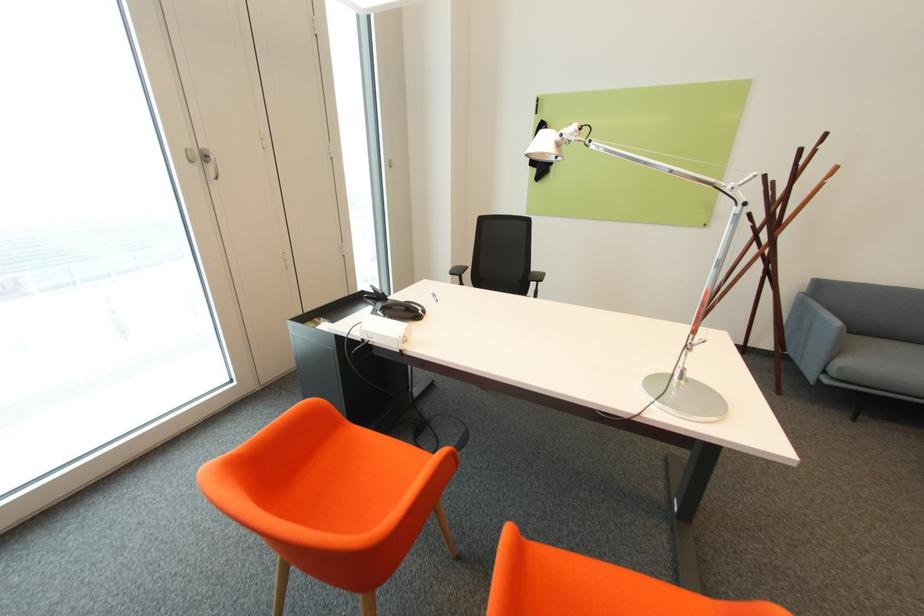
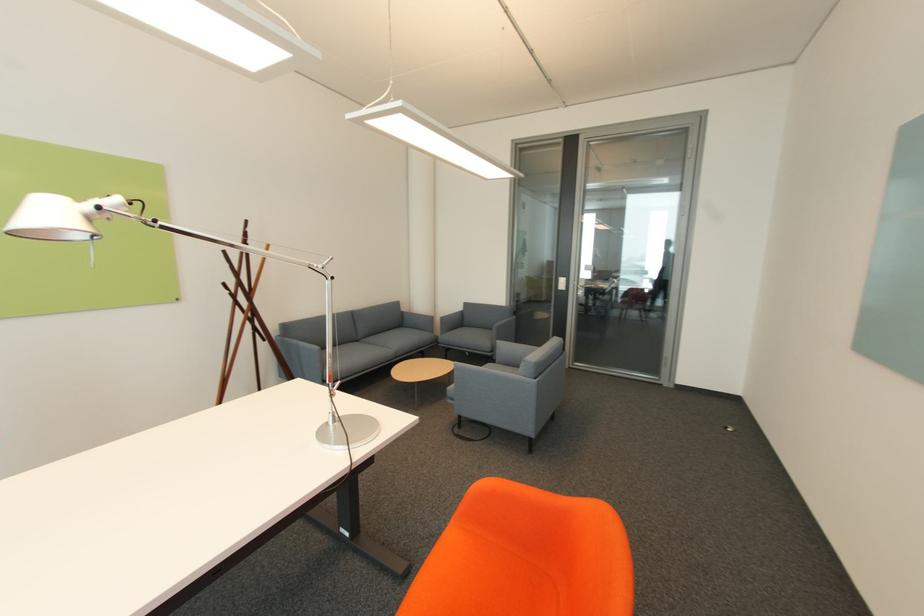
Question: The images are taken continuously from a first-person perspective. In which direction is your viewpoint rotating?

Choices:
 (A) Left
 (B) Right
 (C) Up
 (D) Down

Answer: (B)